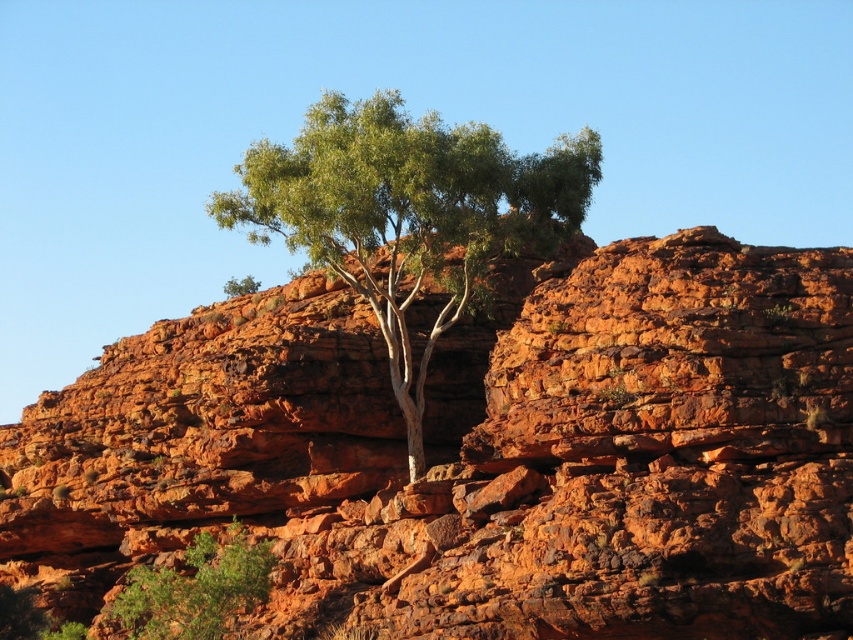
Who is lower down, green leafy tree at center or green leafy tree at lower left?

Positioned lower is green leafy tree at lower left.

Between point (502, 160) and point (142, 572), which one is positioned behind?

The point (502, 160) is behind.

Between point (341, 227) and point (242, 609), which one is positioned behind?

Positioned behind is point (341, 227).

Where is `green leafy tree at center`? This screenshot has height=640, width=853. green leafy tree at center is located at coordinates (408, 212).

Does point (55, 454) lie behind point (258, 236)?

Yes.

Locate an element on the screen. rusty rock at center is located at coordinates (477, 456).

You are a GUI agent. You are given a task and a screenshot of the screen. Output one action in this format:
    pyautogui.click(x=<x>, y=<y>)
    Task: Click on the rusty rock at center
    The width and height of the screenshot is (853, 640).
    Given the screenshot: What is the action you would take?
    pyautogui.click(x=477, y=456)

Which of these two, rusty rock at center or green leafy tree at lower left, stands taller?

rusty rock at center

Is rusty rock at center smaller than green leafy tree at lower left?

Incorrect, rusty rock at center is not smaller in size than green leafy tree at lower left.

Does point (440, 596) come farther from viewer compared to point (138, 584)?

That is False.

Identify the location of rusty rock at center. This screenshot has width=853, height=640. (477, 456).